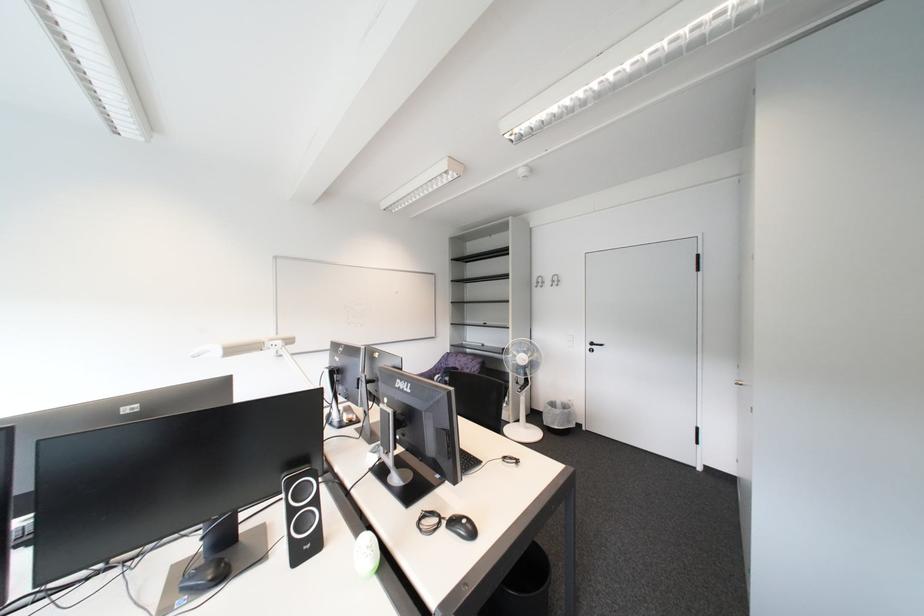
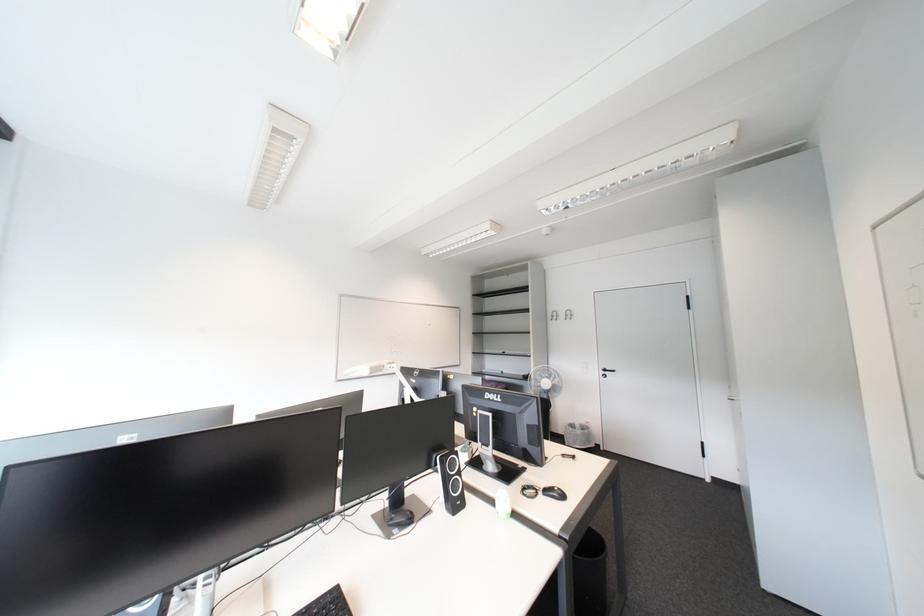
Question: The first image is from the beginning of the video and the second image is from the end. How did the camera likely rotate when shooting the video?

Choices:
 (A) Left
 (B) Right
 (C) Up
 (D) Down

Answer: (C)